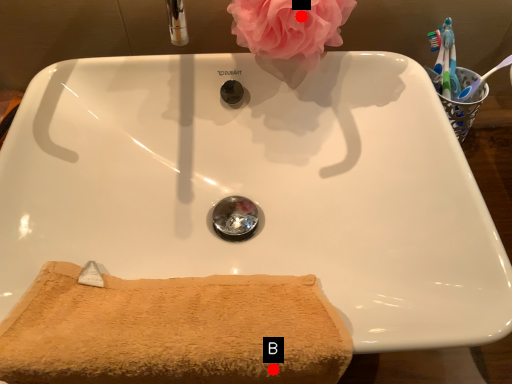
Question: Two points are circled on the image, labeled by A and B beside each circle. Which point is closer to the camera?

Choices:
 (A) A is closer
 (B) B is closer

Answer: (B)